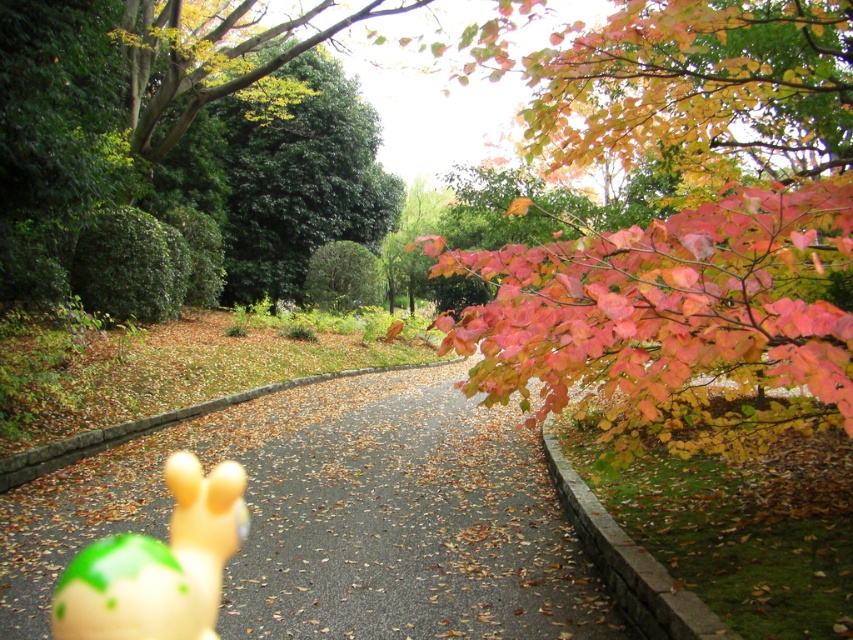
You are a delivery drone flying over an autumn park. You need to land on the smooth asphalt road at center. There is a translucent yellow toy at center in your path. Can you safely land on the road without hitting the toy?

The smooth asphalt road at center might be wider than the translucent yellow toy at center, so there might be enough space to land safely without hitting the toy.